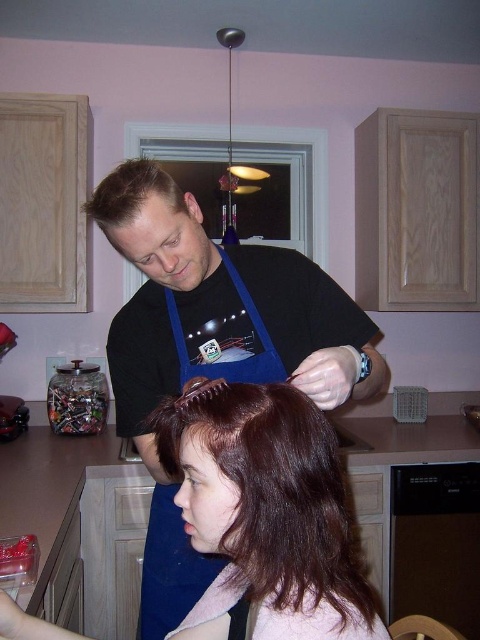
You are a delivery person who needs to place a 12 inch box between the blue apron at center and the wooden cabinets. Can you fit the box there?

The distance between the blue apron at center and the wooden cabinets is 32.38 inches. Since the box is only 12 inches long, there is enough space to place it between them.

You are a tailor measuring fabric lengths in the kitchen. You have a piece of fabric that is 1.2 meters wide. Can you determine if the blue apron at center can be made from this fabric based on its width compared to the dark brown silky hair at lower center?

The blue apron at center is wider than the dark brown silky hair at lower center. Since the fabric is 1.2 meters wide, and the apron requires a width larger than the hair, it should fit as long as the apron width is within the fabric width.